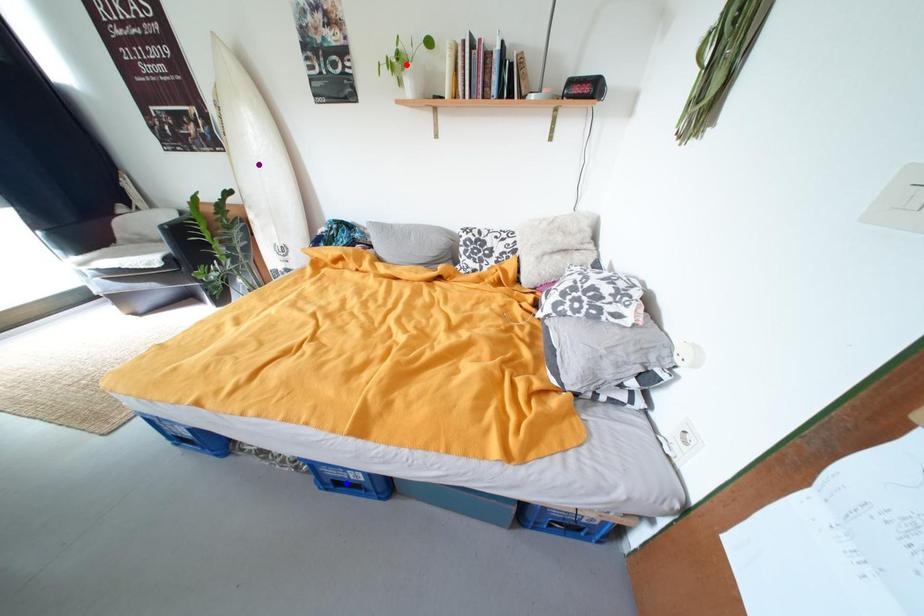
Order these from nearest to farthest:
red point, blue point, purple point

purple point
red point
blue point